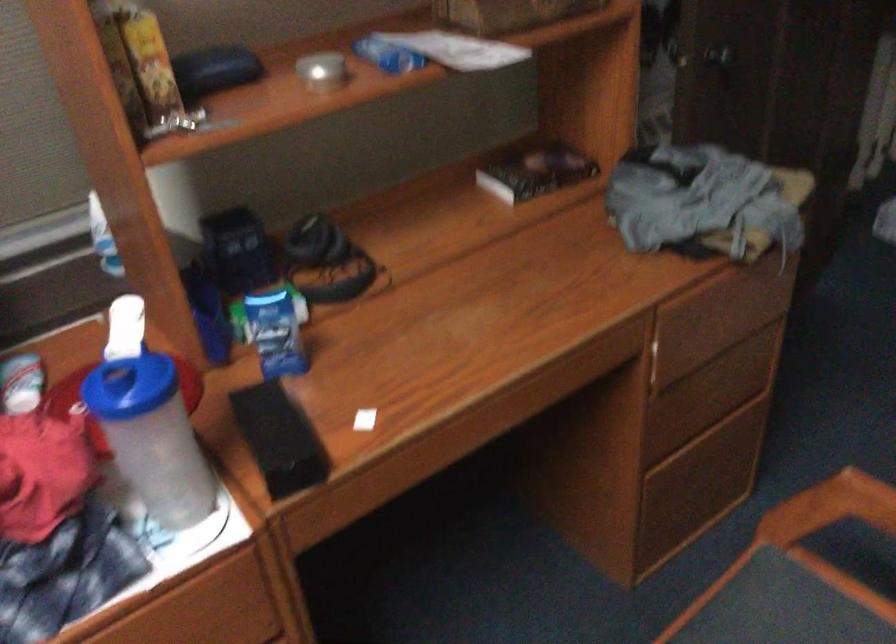
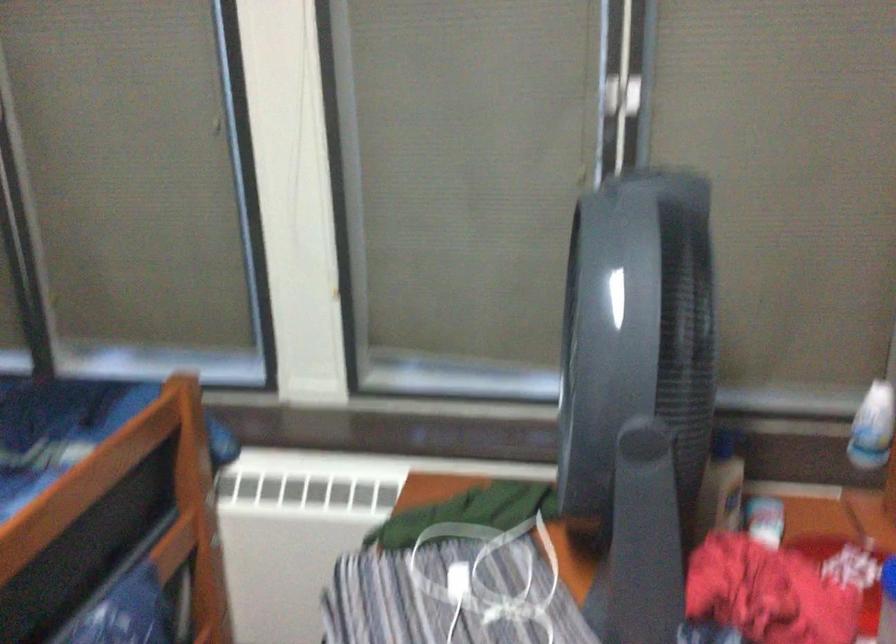
Locate, in the second image, the point that corresponds to point 113,236 in the first image.

(872, 427)